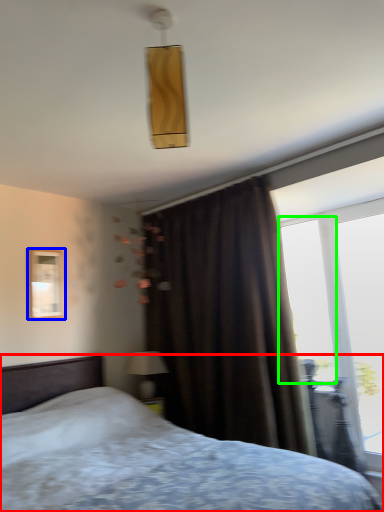
Question: Based on their relative distances, which object is nearer to bed (highlighted by a red box)? Choose from picture frame (highlighted by a blue box) and window screen (highlighted by a green box).

Choices:
 (A) picture frame
 (B) window screen

Answer: (B)